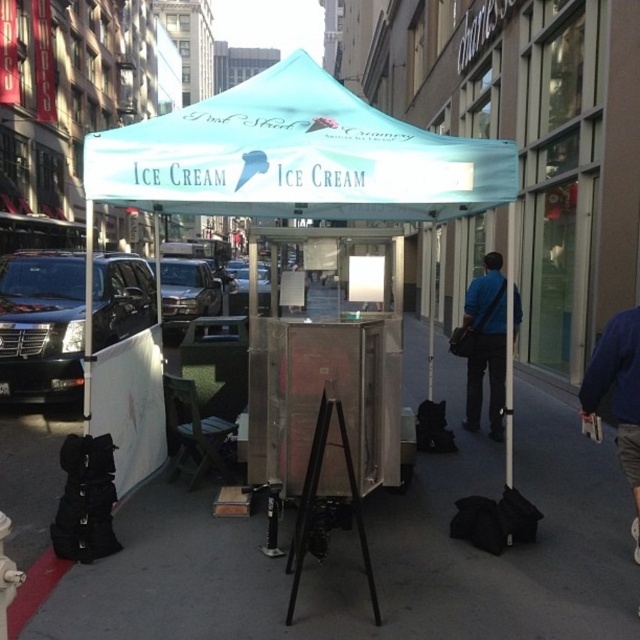
Question: Which point is closer to the camera taking this photo?

Choices:
 (A) (301, 632)
 (B) (218, 204)
 (C) (381, 138)

Answer: (A)

Question: Observing the image, what is the correct spatial positioning of teal fabric canopy at center in reference to black leather bag at center?

Choices:
 (A) right
 (B) left

Answer: (B)

Question: Where is metallic pavement at center located in relation to black leather bag at center in the image?

Choices:
 (A) right
 (B) left

Answer: (B)

Question: Can you confirm if metallic pavement at center is smaller than teal fabric canopy at center?

Choices:
 (A) no
 (B) yes

Answer: (B)

Question: Which point is closer to the camera?

Choices:
 (A) metallic pavement at center
 (B) black leather bag at center

Answer: (A)

Question: Which point is closer to the camera?

Choices:
 (A) black metal tripod at center
 (B) metallic pavement at center
 (C) teal fabric tent at center
 (D) black leather bag at center

Answer: (A)